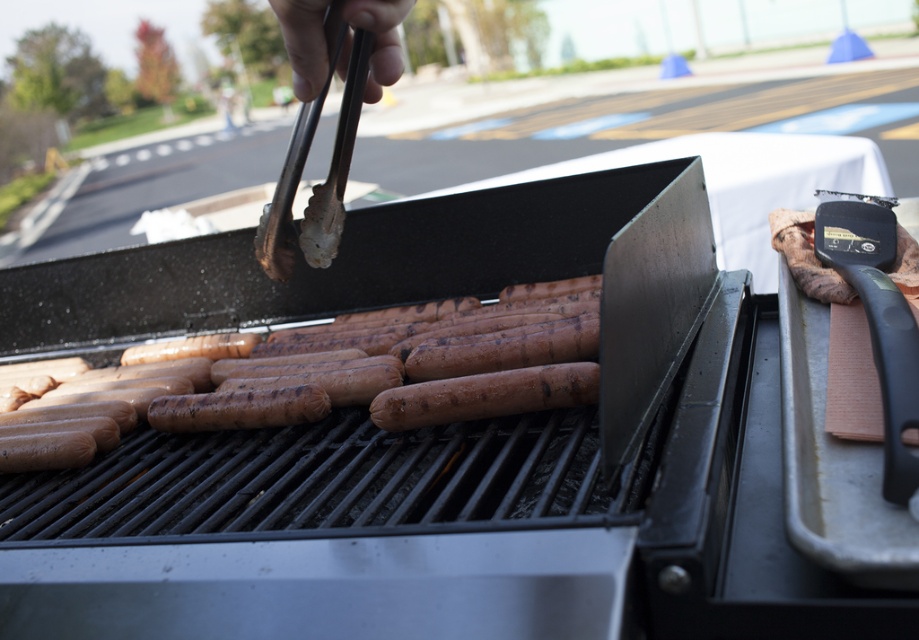
Can you confirm if brown matte hot dog at center is thinner than stainless steel tongs at upper center?

Incorrect, brown matte hot dog at center's width is not less than stainless steel tongs at upper center's.

Between brown matte hot dog at center and stainless steel tongs at upper center, which one appears on the left side from the viewer's perspective?

From the viewer's perspective, brown matte hot dog at center appears more on the left side.

Which is behind, point (355, 385) or point (258, 260)?

Point (258, 260)

I want to click on brown matte hot dog at center, so coord(417,365).

Can you confirm if brown matte hot dog at center is wider than black plastic spatula at right?

Yes.

Who is more forward, (532, 385) or (847, 244)?

Point (532, 385) is in front.

This screenshot has height=640, width=919. Identify the location of brown matte hot dog at center. (417, 365).

Is black plastic spatula at right positioned in front of stainless steel tongs at upper center?

Yes, it is.

Between black plastic spatula at right and stainless steel tongs at upper center, which one has more height?

Standing taller between the two is black plastic spatula at right.

At what (x,y) coordinates should I click in order to perform the action: click on black plastic spatula at right. Please return your answer as a coordinate pair (x, y). Image resolution: width=919 pixels, height=640 pixels. Looking at the image, I should click on (877, 317).